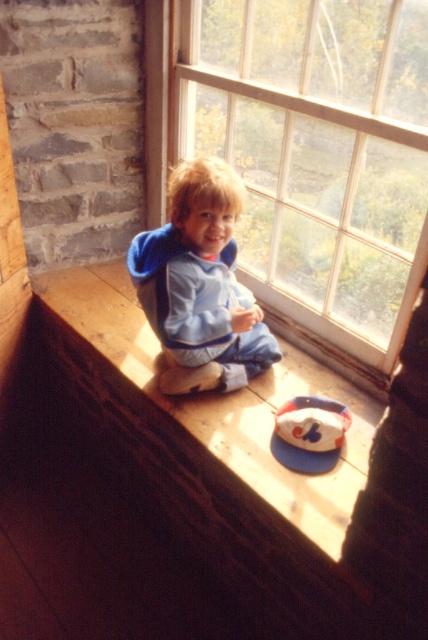
Can you confirm if transparent glass window at upper center is positioned to the left of wooden at lower center?

Incorrect, transparent glass window at upper center is not on the left side of wooden at lower center.

Is transparent glass window at upper center closer to the viewer compared to wooden at lower center?

That is True.

Is point (368, 332) positioned behind point (89, 273)?

That is False.

Identify the location of transparent glass window at upper center. The height and width of the screenshot is (640, 428). (x=315, y=150).

Is wooden at lower center below blue fleece jacket at center?

Yes, wooden at lower center is below blue fleece jacket at center.

Find the location of a particular element. wooden at lower center is located at coordinates (225, 401).

Where is `wooden at lower center`? The height and width of the screenshot is (640, 428). wooden at lower center is located at coordinates (x=225, y=401).

In the scene shown: Does transparent glass window at upper center appear over blue fleece jacket at center?

Indeed, transparent glass window at upper center is positioned over blue fleece jacket at center.

Is transparent glass window at upper center to the right of blue fleece jacket at center from the viewer's perspective?

Correct, you'll find transparent glass window at upper center to the right of blue fleece jacket at center.

Who is more distant from viewer, (419, 221) or (193, 218)?

Point (419, 221)

Where is `transparent glass window at upper center`? This screenshot has width=428, height=640. transparent glass window at upper center is located at coordinates (315, 150).